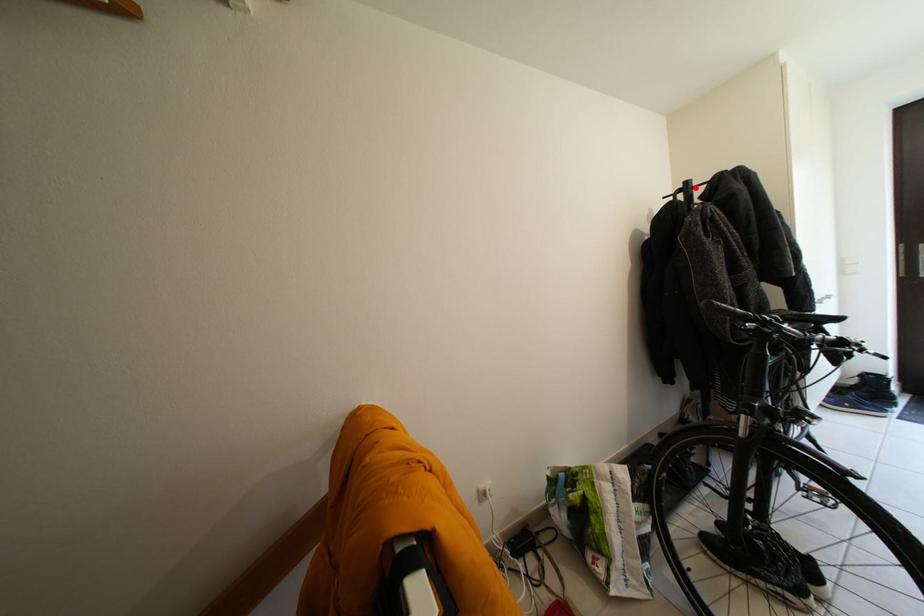
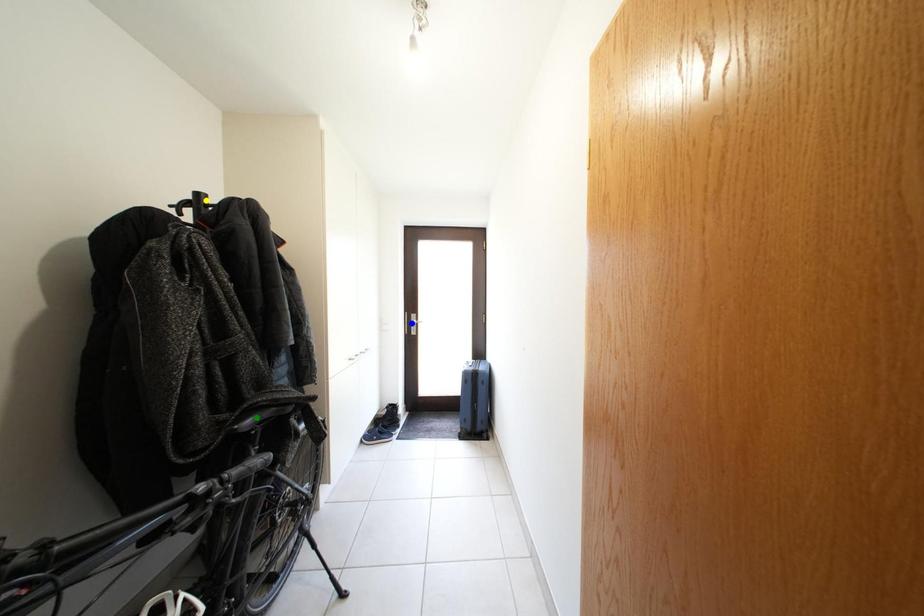
Question: I am providing you with two images of the same scene from different viewpoints. A red point is marked on the first image. You are given multiple points on the second image. In image 2, which mark is for the same physical point as the one in image 1?

Choices:
 (A) green point
 (B) blue point
 (C) yellow point

Answer: (C)